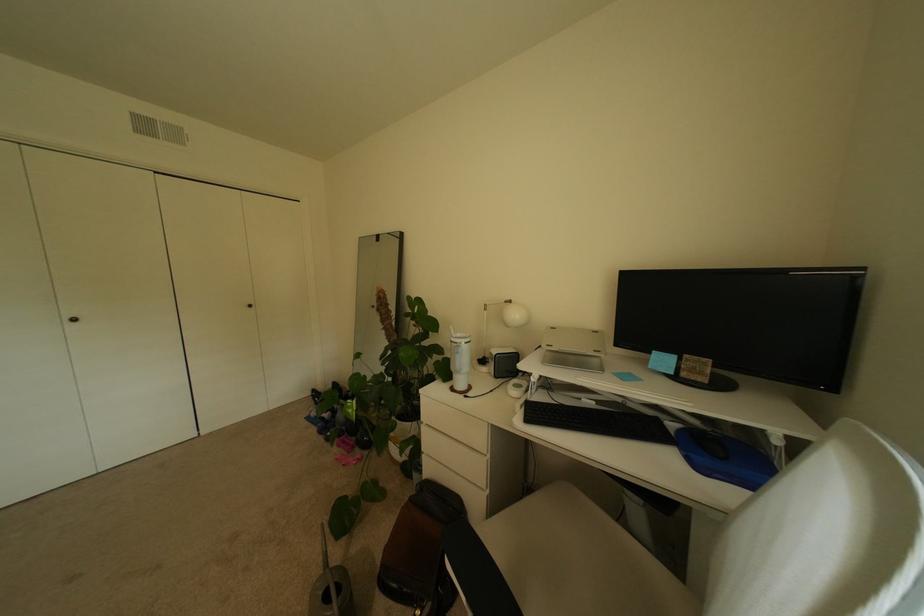
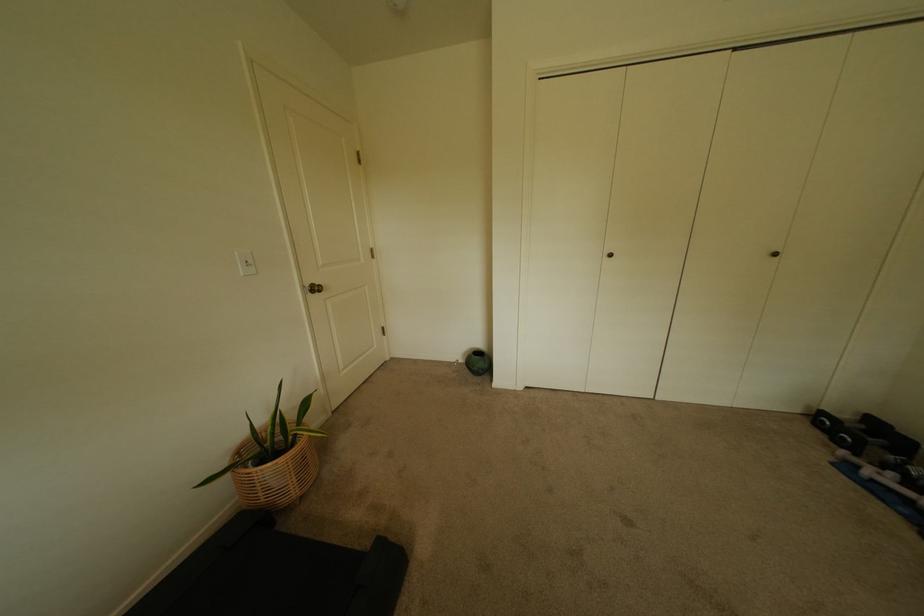
Locate, in the second image, the point that corresponds to (82,321) in the first image.

(618, 256)